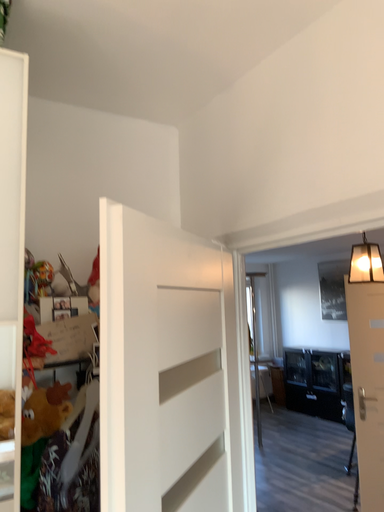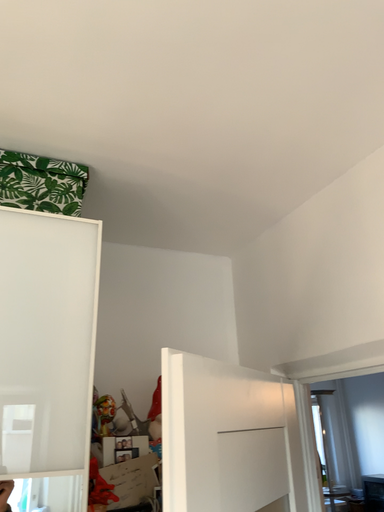
Question: Which way did the camera rotate in the video?

Choices:
 (A) rotated downward
 (B) rotated upward

Answer: (B)